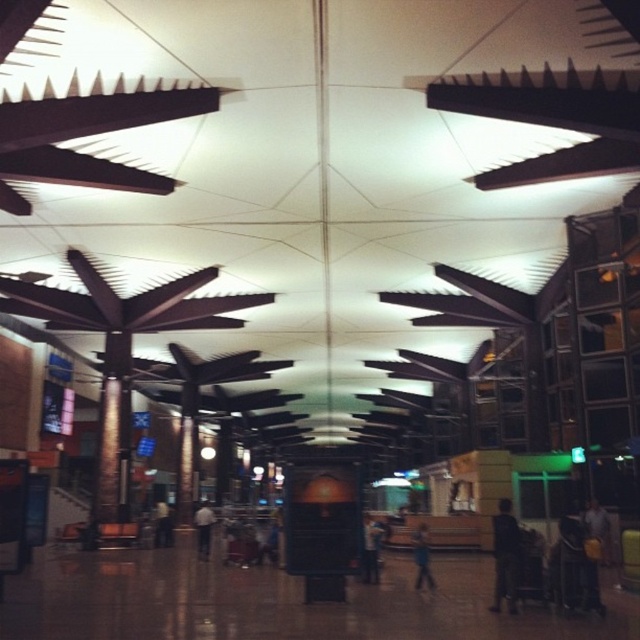
You are standing in the modern building and notice a blue fabric person at center and a dark brown leather jacket at center. Which object is nearer to you?

The blue fabric person at center is closer to the viewer than the dark brown leather jacket at center.

You are standing in the modern airport terminal and see two points marked on the ceiling. The first point is at coordinates point [424,557], and the second is at point [202,524]. Which point is closer to you?

Point [424,557] is closer to the viewer than point [202,524].

You are a security guard in the airport terminal. You notice a dark fabric bag at center and a blue fabric person at center. Which object is larger in size?

The dark fabric bag at center is bigger than the blue fabric person at center.